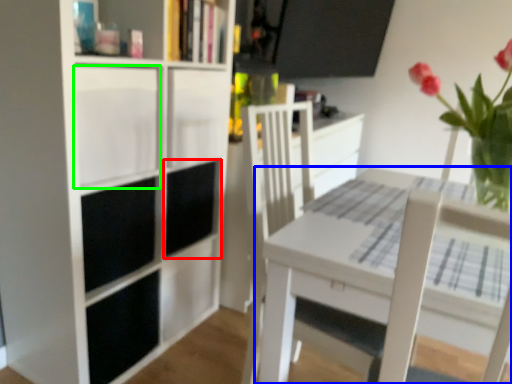
Question: Based on their relative distances, which object is nearer to cabinet (highlighted by a red box)? Choose from table (highlighted by a blue box) and cabinet (highlighted by a green box).

Choices:
 (A) table
 (B) cabinet

Answer: (B)